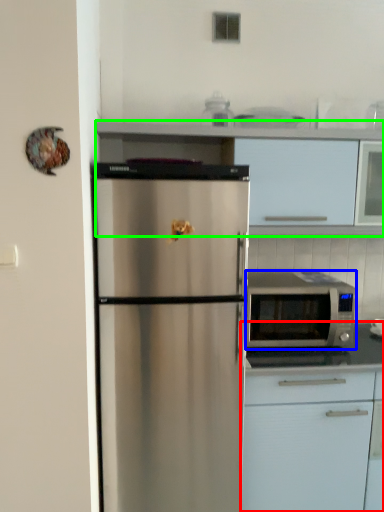
Question: Which object is positioned farthest from cabinetry (highlighted by a red box)? Select from microwave oven (highlighted by a blue box) and cabinetry (highlighted by a green box).

Choices:
 (A) microwave oven
 (B) cabinetry

Answer: (B)